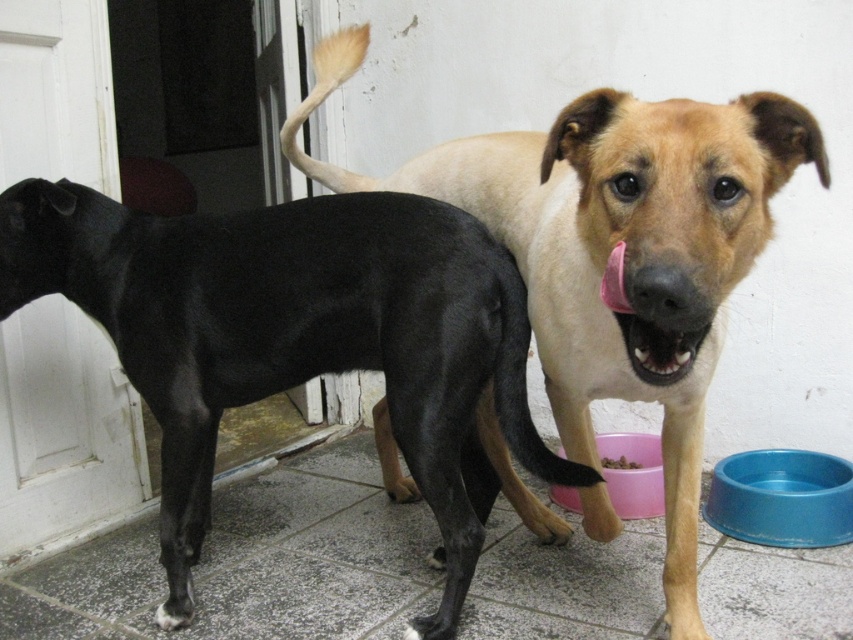
Is black smooth dog at left bigger than light brown fur dog at center?

No, black smooth dog at left is not bigger than light brown fur dog at center.

Is black smooth dog at left taller than light brown fur dog at center?

In fact, black smooth dog at left may be shorter than light brown fur dog at center.

Is point (3, 314) closer to camera compared to point (703, 264)?

That is False.

What are the coordinates of `black smooth dog at left` in the screenshot? It's located at (296, 339).

Between point (187, 324) and point (601, 461), which one is positioned in front?

Point (187, 324)

Based on the photo, does black smooth dog at left come behind brown crumbly food at lower center?

No, black smooth dog at left is closer to the viewer.

Based on the photo, measure the distance between point (213, 454) and camera.

Point (213, 454) is 7.18 feet away from camera.

Image resolution: width=853 pixels, height=640 pixels. I want to click on black smooth dog at left, so click(x=296, y=339).

Can you confirm if light brown fur dog at center is positioned below brown crumbly food at lower center?

Actually, light brown fur dog at center is above brown crumbly food at lower center.

Which is behind, point (651, 177) or point (637, 461)?

The point (637, 461) is more distant.

This screenshot has height=640, width=853. Find the location of `light brown fur dog at center`. light brown fur dog at center is located at coordinates (612, 248).